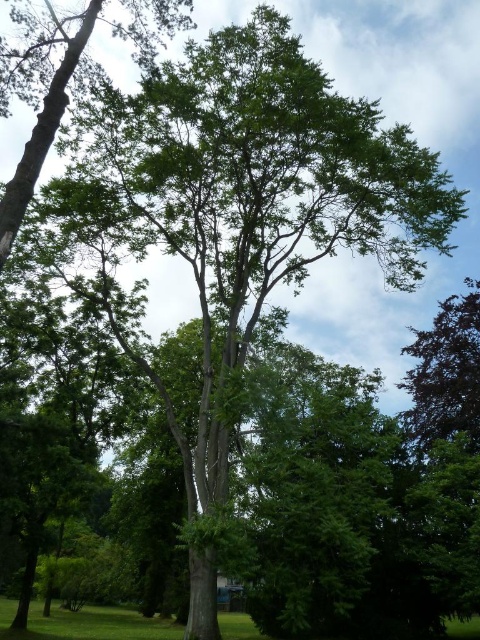
Based on the scene described, which tree, the green leafy tree at center or the dark green leafy tree at upper right, would cast a larger shadow during midday when the sun is directly overhead?

The green leafy tree at center is bigger than the dark green leafy tree at upper right, so it would cast a larger shadow during midday when the sun is directly overhead.

In the scene shown: You are standing in the middle of a forest and see the green leafy tree at center and the dark green leafy tree at upper right. Which tree is closer to your left side?

The green leafy tree at center is positioned on the left side of dark green leafy tree at upper right, so it is closer to your left side.